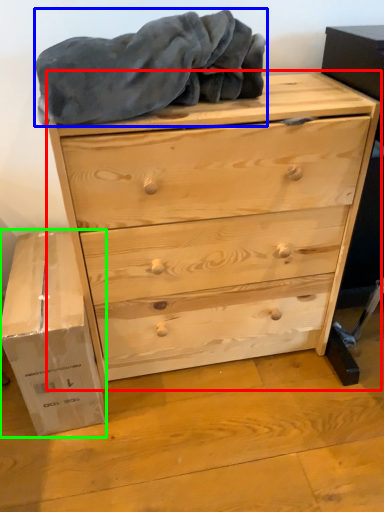
Question: Considering the real-world distances, which object is farthest from chest of drawers (highlighted by a red box)? blanket (highlighted by a blue box) or cardboard box (highlighted by a green box)?

Choices:
 (A) blanket
 (B) cardboard box

Answer: (B)